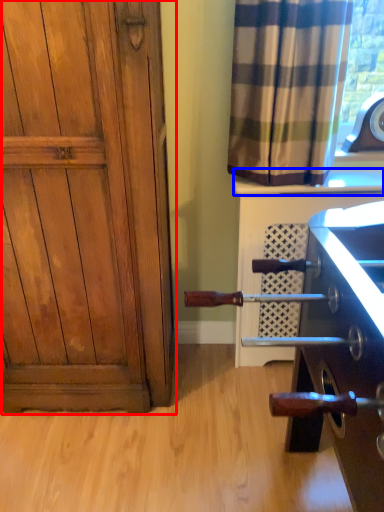
Question: Which of the following is the closest to the observer, door (highlighted by a red box) or window sill (highlighted by a blue box)?

Choices:
 (A) door
 (B) window sill

Answer: (A)